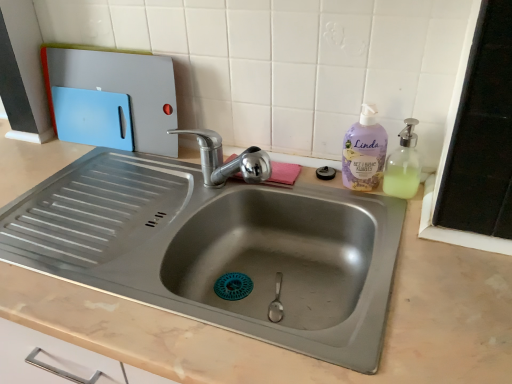
Question: Does lavender plastic bottle at right lie behind translucent plastic soap dispenser at right?

Choices:
 (A) yes
 (B) no

Answer: (A)

Question: Considering the relative positions of lavender plastic bottle at right and translucent plastic soap dispenser at right in the image provided, is lavender plastic bottle at right to the left of translucent plastic soap dispenser at right from the viewer's perspective?

Choices:
 (A) yes
 (B) no

Answer: (A)

Question: Can you confirm if lavender plastic bottle at right is shorter than translucent plastic soap dispenser at right?

Choices:
 (A) yes
 (B) no

Answer: (B)

Question: Is lavender plastic bottle at right directly adjacent to translucent plastic soap dispenser at right?

Choices:
 (A) yes
 (B) no

Answer: (A)

Question: Does lavender plastic bottle at right turn towards translucent plastic soap dispenser at right?

Choices:
 (A) yes
 (B) no

Answer: (B)

Question: Considering their positions, is translucent plastic soap dispenser at right located in front of or behind blue plastic cutting board at upper left?

Choices:
 (A) behind
 (B) front

Answer: (B)

Question: Is translucent plastic soap dispenser at right wider or thinner than blue plastic cutting board at upper left?

Choices:
 (A) thin
 (B) wide

Answer: (B)

Question: From their relative heights in the image, would you say translucent plastic soap dispenser at right is taller or shorter than blue plastic cutting board at upper left?

Choices:
 (A) tall
 (B) short

Answer: (B)

Question: Is translucent plastic soap dispenser at right situated inside blue plastic cutting board at upper left or outside?

Choices:
 (A) outside
 (B) inside

Answer: (A)

Question: Considering the positions of blue plastic cutting board at upper left and translucent plastic soap dispenser at right in the image, is blue plastic cutting board at upper left taller or shorter than translucent plastic soap dispenser at right?

Choices:
 (A) short
 (B) tall

Answer: (B)

Question: Looking at their shapes, would you say blue plastic cutting board at upper left is wider or thinner than translucent plastic soap dispenser at right?

Choices:
 (A) wide
 (B) thin

Answer: (B)

Question: From a real-world perspective, is blue plastic cutting board at upper left above or below translucent plastic soap dispenser at right?

Choices:
 (A) below
 (B) above

Answer: (B)

Question: In terms of size, does blue plastic cutting board at upper left appear bigger or smaller than translucent plastic soap dispenser at right?

Choices:
 (A) small
 (B) big

Answer: (B)

Question: Considering the positions of lavender plastic bottle at right and blue plastic cutting board at upper left in the image, is lavender plastic bottle at right taller or shorter than blue plastic cutting board at upper left?

Choices:
 (A) short
 (B) tall

Answer: (A)

Question: Looking at their shapes, would you say lavender plastic bottle at right is wider or thinner than blue plastic cutting board at upper left?

Choices:
 (A) thin
 (B) wide

Answer: (B)